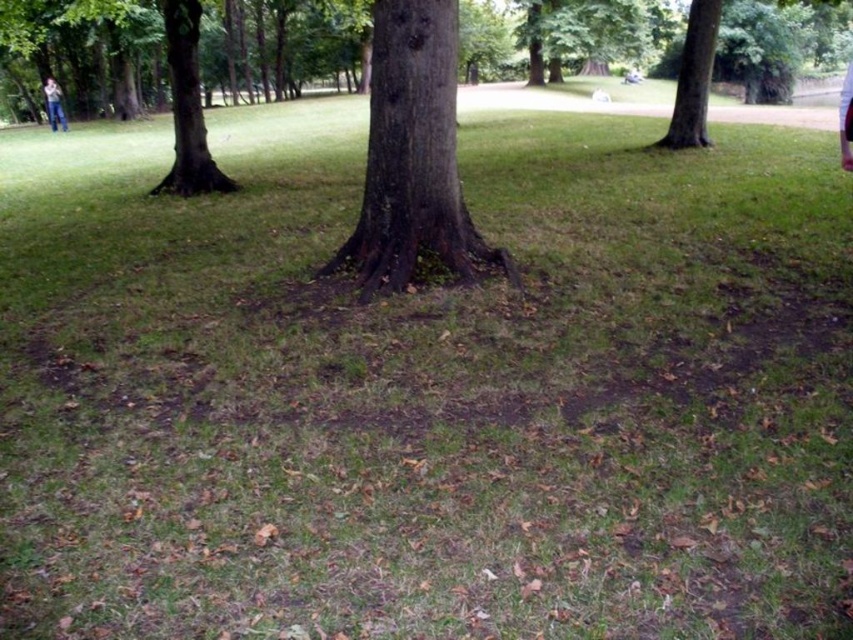
Is smooth bark tree at upper right to the left of jeans-clad person at upper left from the viewer's perspective?

No, smooth bark tree at upper right is not to the left of jeans-clad person at upper left.

Who is more forward, (x=703, y=35) or (x=57, y=92)?

Point (x=703, y=35) is more forward.

This screenshot has height=640, width=853. In order to click on smooth bark tree at upper right in this screenshot , I will do `click(693, 77)`.

Does brown rough bark tree at left appear under smooth bark tree at upper right?

Indeed, brown rough bark tree at left is positioned under smooth bark tree at upper right.

Between brown rough bark tree at left and smooth bark tree at upper right, which one has more height?

Standing taller between the two is smooth bark tree at upper right.

Who is more distant from viewer, (x=202, y=138) or (x=700, y=3)?

Positioned behind is point (x=700, y=3).

The height and width of the screenshot is (640, 853). In order to click on brown rough bark tree at left in this screenshot , I will do `click(187, 106)`.

Who is positioned more to the right, brown rough bark tree at left or jeans-clad person at upper left?

brown rough bark tree at left

Is point (178, 3) positioned after point (50, 124)?

That is False.

Between point (190, 193) and point (44, 96), which one is positioned in front?

Positioned in front is point (190, 193).

Where is `brown rough bark tree at left`? The width and height of the screenshot is (853, 640). brown rough bark tree at left is located at coordinates (187, 106).